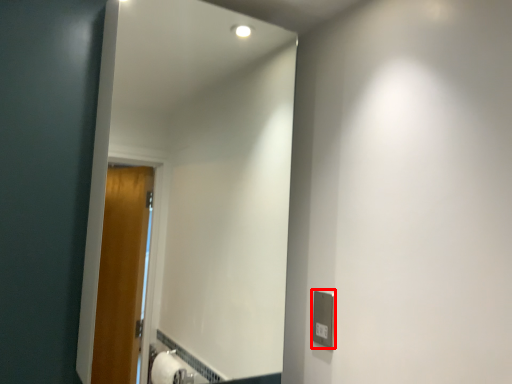
Question: Where is electric outlet (annotated by the red box) located in relation to mirror in the image?

Choices:
 (A) right
 (B) left

Answer: (A)